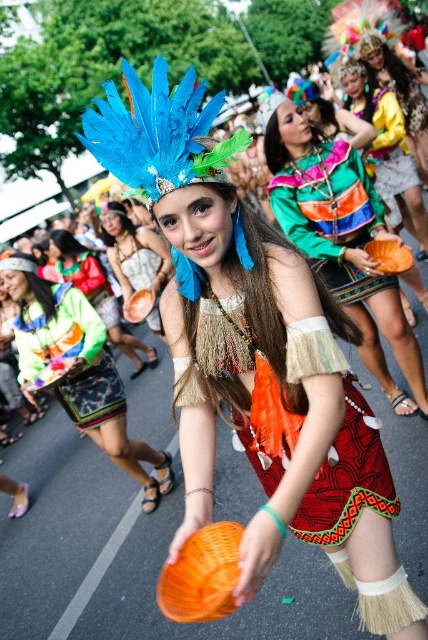
Question: Is shiny orange pumpkin at center below matte blue feather headdress at upper center?

Choices:
 (A) no
 (B) yes

Answer: (B)

Question: Which is nearer to the matte orange bowl at center?

Choices:
 (A) shiny orange pumpkin at center
 (B) matte blue feather headdress at upper center
 (C) multicolored woven fabric skirt at lower left
 (D) shiny metallic vest at center

Answer: (C)

Question: Where is multicolored woven fabric skirt at lower left located in relation to matte blue feather headdress at upper center in the image?

Choices:
 (A) below
 (B) above

Answer: (A)

Question: Which of the following is the farthest from the observer?

Choices:
 (A) multicolored woven fabric skirt at lower left
 (B) shiny metallic vest at center
 (C) matte blue feather headdress at upper center
 (D) shiny orange pumpkin at center

Answer: (C)

Question: Among these objects, which one is nearest to the camera?

Choices:
 (A) shiny orange pumpkin at center
 (B) matte orange bowl at center

Answer: (A)

Question: Does shiny orange pumpkin at center come in front of matte orange bowl at center?

Choices:
 (A) yes
 (B) no

Answer: (A)